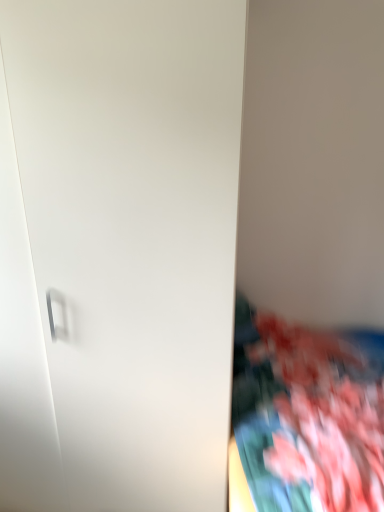
Measure the distance between point (360, 387) and camera.

5.12 feet.

Measure the distance between floral fabric at right and camera.

floral fabric at right and camera are 1.15 meters apart.

Locate an element on the screen. This screenshot has height=512, width=384. floral fabric at right is located at coordinates [x=308, y=414].

The width and height of the screenshot is (384, 512). What do you see at coordinates (308, 414) in the screenshot? I see `floral fabric at right` at bounding box center [308, 414].

This screenshot has height=512, width=384. Find the location of `white matte door at center`. white matte door at center is located at coordinates (132, 234).

What do you see at coordinates (132, 234) in the screenshot?
I see `white matte door at center` at bounding box center [132, 234].

You are a GUI agent. You are given a task and a screenshot of the screen. Output one action in this format:
    pyautogui.click(x=<x>, y=<y>)
    Task: Click on the floral fabric at right
    The image size is (384, 512).
    Given the screenshot: What is the action you would take?
    pyautogui.click(x=308, y=414)

Does floral fabric at right appear on the right side of white matte door at center?

Yes.

From the picture: Is floral fabric at right behind white matte door at center?

No, it is not.

Which is closer to the camera, (x=252, y=413) or (x=68, y=152)?

The point (x=68, y=152) is in front.

From the image's perspective, between floral fabric at right and white matte door at center, who is located below?

floral fabric at right, from the image's perspective.

From a real-world perspective, which is physically below, floral fabric at right or white matte door at center?

In real-world perspective, floral fabric at right is lower.

Considering the relative sizes of floral fabric at right and white matte door at center in the image provided, is floral fabric at right thinner than white matte door at center?

Incorrect, the width of floral fabric at right is not less than that of white matte door at center.

Is floral fabric at right taller or shorter than white matte door at center?

Clearly, floral fabric at right is shorter compared to white matte door at center.

Which of these two, floral fabric at right or white matte door at center, is smaller?

floral fabric at right.

Is floral fabric at right spatially inside white matte door at center, or outside of it?

The correct answer is: outside.

Does floral fabric at right touch white matte door at center?

No, floral fabric at right is not in contact with white matte door at center.

Is white matte door at center at the back of floral fabric at right?

floral fabric at right does not have its back to white matte door at center.

Measure the distance from floral fabric at right to white matte door at center.

The distance of floral fabric at right from white matte door at center is 19.49 inches.

Find the location of a particular element. The width and height of the screenshot is (384, 512). door above the floral fabric at right (from a real-world perspective) is located at coordinates (132, 234).

Is white matte door at center to the left of floral fabric at right from the viewer's perspective?

Yes, white matte door at center is to the left of floral fabric at right.

Which object is closer to the camera, white matte door at center or floral fabric at right?

floral fabric at right is more forward.

Between point (75, 285) and point (267, 331), which one is positioned in front?

The point (75, 285) is more forward.

From the image's perspective, does white matte door at center appear higher than floral fabric at right?

Yes, from the image's perspective, white matte door at center is above floral fabric at right.

From a real-world perspective, who is located lower, white matte door at center or floral fabric at right?

floral fabric at right, from a real-world perspective.

Considering the sizes of white matte door at center and floral fabric at right in the image, is white matte door at center wider or thinner than floral fabric at right?

white matte door at center is thinner than floral fabric at right.

Considering the sizes of objects white matte door at center and floral fabric at right in the image provided, who is taller, white matte door at center or floral fabric at right?

white matte door at center is taller.

Between white matte door at center and floral fabric at right, which one has smaller size?

With smaller size is floral fabric at right.

Would you say white matte door at center is outside floral fabric at right?

Yes.

Does white matte door at center touch floral fabric at right?

There is a gap between white matte door at center and floral fabric at right.

Is white matte door at center oriented away from floral fabric at right?

No, floral fabric at right is not at the back of white matte door at center.

How far apart are white matte door at center and floral fabric at right?

white matte door at center is 49.50 centimeters from floral fabric at right.

This screenshot has height=512, width=384. I want to click on door above the floral fabric at right (from the image's perspective), so click(x=132, y=234).

Image resolution: width=384 pixels, height=512 pixels. Find the location of `door located above the floral fabric at right (from the image's perspective)`. door located above the floral fabric at right (from the image's perspective) is located at coordinates (132, 234).

Where is `textile in front of the white matte door at center`? textile in front of the white matte door at center is located at coordinates pos(308,414).